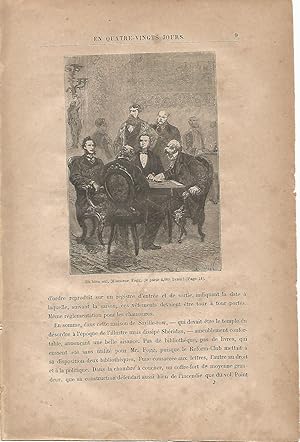
Locate an element on the screen. This screenshot has width=300, height=442. table is located at coordinates (166, 187).